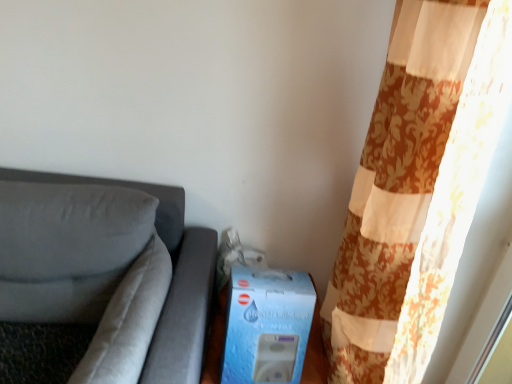
Question: Considering the positions of blue cardboard box at lower center and suede-like gray pillow at left in the image, is blue cardboard box at lower center bigger or smaller than suede-like gray pillow at left?

Choices:
 (A) small
 (B) big

Answer: (A)

Question: From their relative heights in the image, would you say blue cardboard box at lower center is taller or shorter than suede-like gray pillow at left?

Choices:
 (A) short
 (B) tall

Answer: (A)

Question: Considering the real-world distances, which object is farthest from the blue cardboard box at lower center?

Choices:
 (A) suede gray couch at left
 (B) suede-like gray pillow at left
 (C) floral fabric curtain at right

Answer: (B)

Question: Which object is the farthest from the suede gray couch at left?

Choices:
 (A) blue cardboard box at lower center
 (B) suede-like gray pillow at left
 (C) floral fabric curtain at right

Answer: (C)